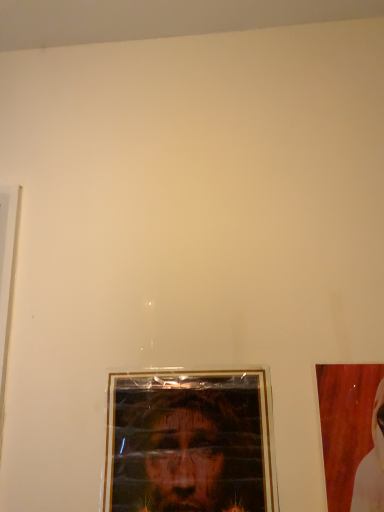
Question: From a real-world perspective, relative to matte plastic portrait at center, is wooden picture frame at right vertically above or below?

Choices:
 (A) below
 (B) above

Answer: (B)

Question: In terms of width, does wooden picture frame at right look wider or thinner when compared to matte plastic portrait at center?

Choices:
 (A) wide
 (B) thin

Answer: (B)

Question: From the image's perspective, is wooden picture frame at right above or below matte plastic portrait at center?

Choices:
 (A) above
 (B) below

Answer: (A)

Question: In the image, is matte plastic portrait at center positioned in front of or behind wooden picture frame at right?

Choices:
 (A) front
 (B) behind

Answer: (B)

Question: Looking at the image, does matte plastic portrait at center seem bigger or smaller compared to wooden picture frame at right?

Choices:
 (A) small
 (B) big

Answer: (B)

Question: Considering the positions of point (213, 498) and point (332, 369), is point (213, 498) closer or farther from the camera than point (332, 369)?

Choices:
 (A) farther
 (B) closer

Answer: (B)

Question: From the image's perspective, relative to wooden picture frame at right, is matte plastic portrait at center above or below?

Choices:
 (A) below
 (B) above

Answer: (A)